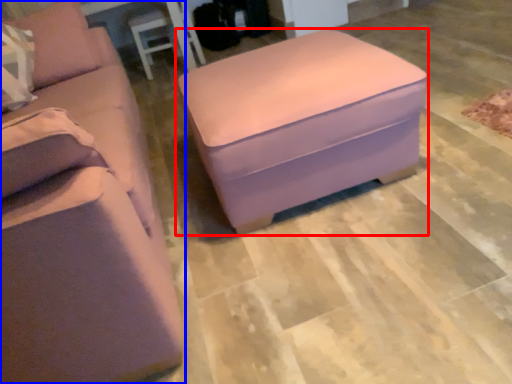
Question: Among these objects, which one is farthest to the camera, table (highlighted by a red box) or studio couch (highlighted by a blue box)?

Choices:
 (A) table
 (B) studio couch

Answer: (A)